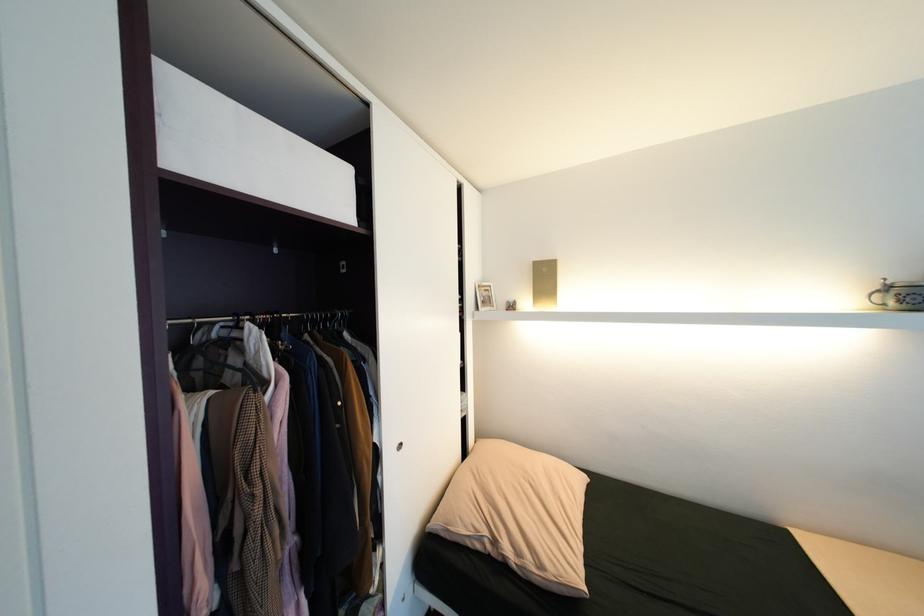
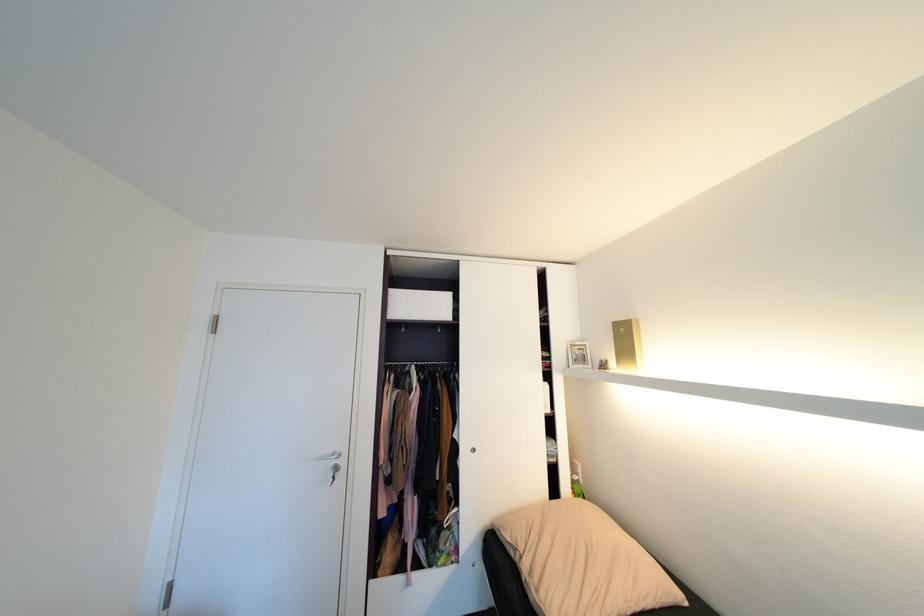
Where in the second image is the point corresponding to [493,291] from the first image?

(587, 350)